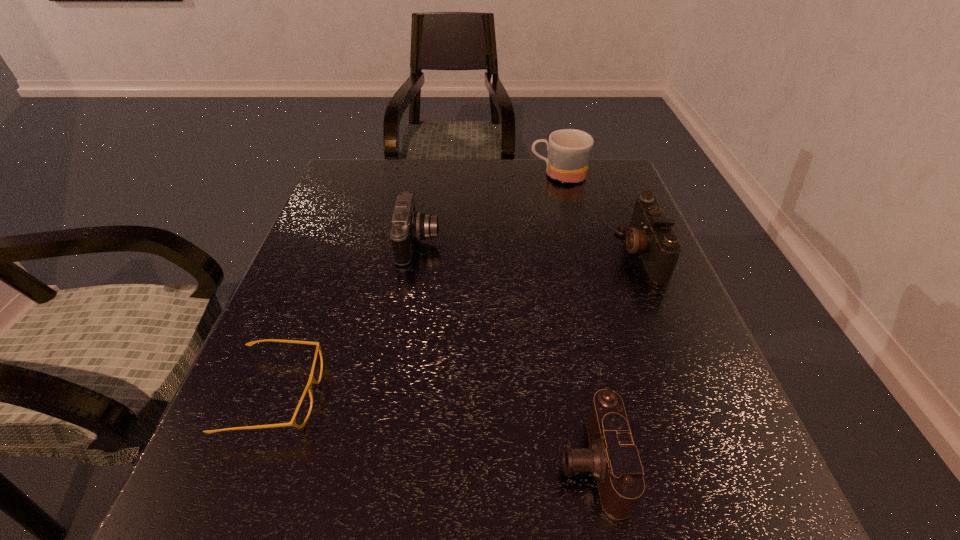
Where is `mug`? The height and width of the screenshot is (540, 960). mug is located at coordinates (569, 150).

Image resolution: width=960 pixels, height=540 pixels. I want to click on the second object from left to right, so click(x=408, y=226).

Find the location of a particular element. The image size is (960, 540). the rightmost camera is located at coordinates (650, 234).

Where is `the shortest camera`? The image size is (960, 540). the shortest camera is located at coordinates (612, 458).

Find the location of a particular element. The height and width of the screenshot is (540, 960). the nearest camera is located at coordinates (612, 458).

Where is `the shortest object`? the shortest object is located at coordinates (311, 380).

You are a GUI agent. You are given a task and a screenshot of the screen. Output one action in this format:
    pyautogui.click(x=<x>, y=<y>)
    Task: Click on the leftmost object
    This screenshot has height=540, width=960.
    Given the screenshot: What is the action you would take?
    coord(311,380)

Image resolution: width=960 pixels, height=540 pixels. Identify the location of vacant region located on the side with the handle of the mug. (465, 175).

Identify the location of free spot located 0.180m on the side with the handle of the mug. The width and height of the screenshot is (960, 540). (468, 175).

The image size is (960, 540). Identify the location of free space located on the side with the handle of the mug. (495, 175).